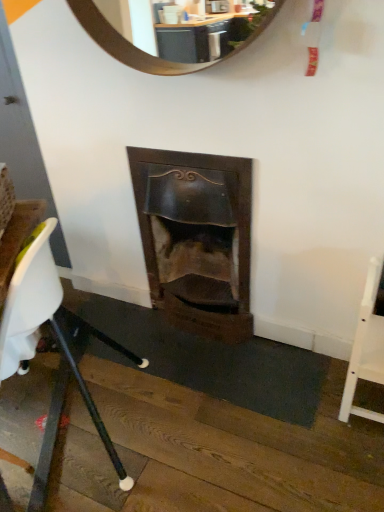
Where is `free space to the right of white plastic chair at lower left, acting as the first chair starting from the left`? The height and width of the screenshot is (512, 384). free space to the right of white plastic chair at lower left, acting as the first chair starting from the left is located at coordinates (193, 412).